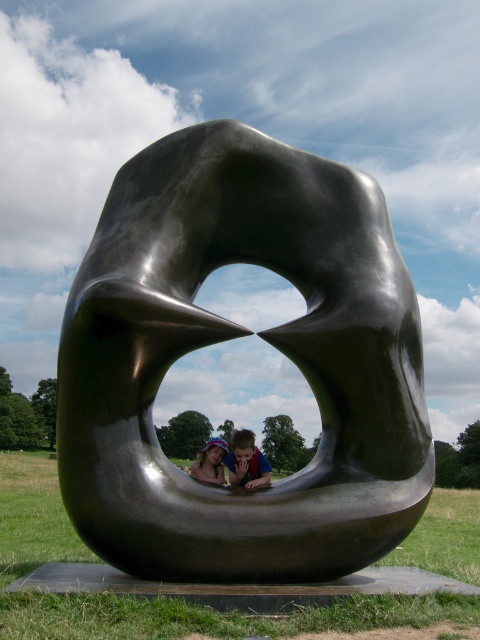
Can you confirm if blue fabric face at center is wider than matte blue hat at center?

Indeed, blue fabric face at center has a greater width compared to matte blue hat at center.

The height and width of the screenshot is (640, 480). What do you see at coordinates (245, 461) in the screenshot?
I see `blue fabric face at center` at bounding box center [245, 461].

Is point (240, 435) positioned in front of point (201, 456)?

Yes, it is in front of point (201, 456).

Find the location of a particular element. This screenshot has width=480, height=640. blue fabric face at center is located at coordinates (245, 461).

Does shiny dark green sculpture at center have a greater width compared to matte blue hat at center?

Yes, shiny dark green sculpture at center is wider than matte blue hat at center.

Where is `shiny dark green sculpture at center`? shiny dark green sculpture at center is located at coordinates (237, 337).

Who is more forward, (130, 486) or (243, 451)?

Point (130, 486) is more forward.

Is shiny dark green sculpture at center to the right of blue fabric face at center from the viewer's perspective?

Indeed, shiny dark green sculpture at center is positioned on the right side of blue fabric face at center.

Is point (109, 352) farther from viewer compared to point (241, 474)?

That is False.

Identify the location of shiny dark green sculpture at center. Image resolution: width=480 pixels, height=640 pixels. (237, 337).